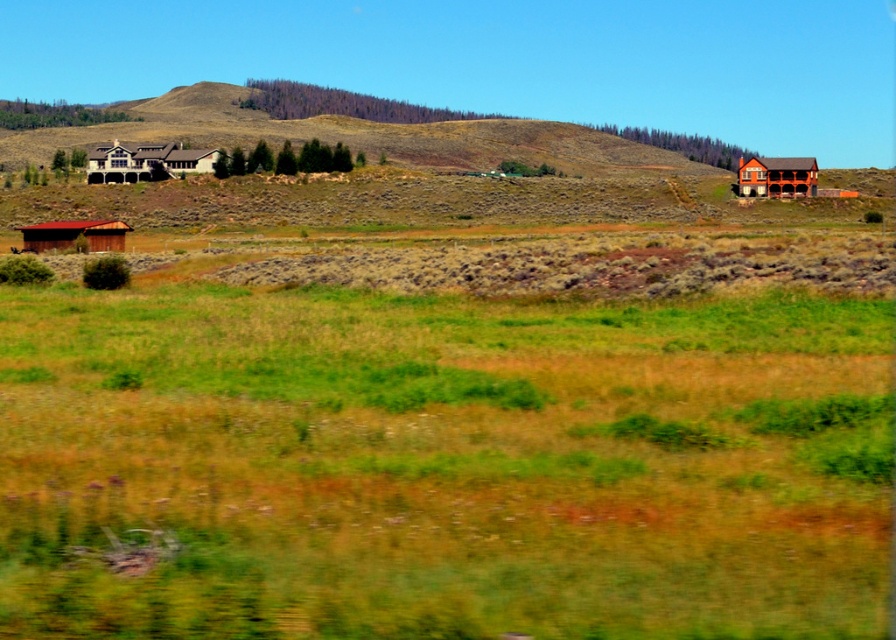
Question: Among these points, which one is nearest to the camera?

Choices:
 (A) (116, 160)
 (B) (800, 166)

Answer: (B)

Question: Can you confirm if brown wooden house at right is positioned above matte white house at upper left?

Choices:
 (A) no
 (B) yes

Answer: (A)

Question: Is white wood house at left further to the viewer compared to brown wooden house at right?

Choices:
 (A) yes
 (B) no

Answer: (A)

Question: Observing the image, what is the correct spatial positioning of white wood house at left in reference to matte white house at upper left?

Choices:
 (A) left
 (B) right

Answer: (B)

Question: Which point is closer to the camera taking this photo?

Choices:
 (A) (754, 173)
 (B) (110, 221)
 (C) (122, 163)
 (D) (224, 152)

Answer: (B)

Question: Which object is closer to the camera taking this photo?

Choices:
 (A) white wood house at left
 (B) brown wooden hut at lower left

Answer: (B)